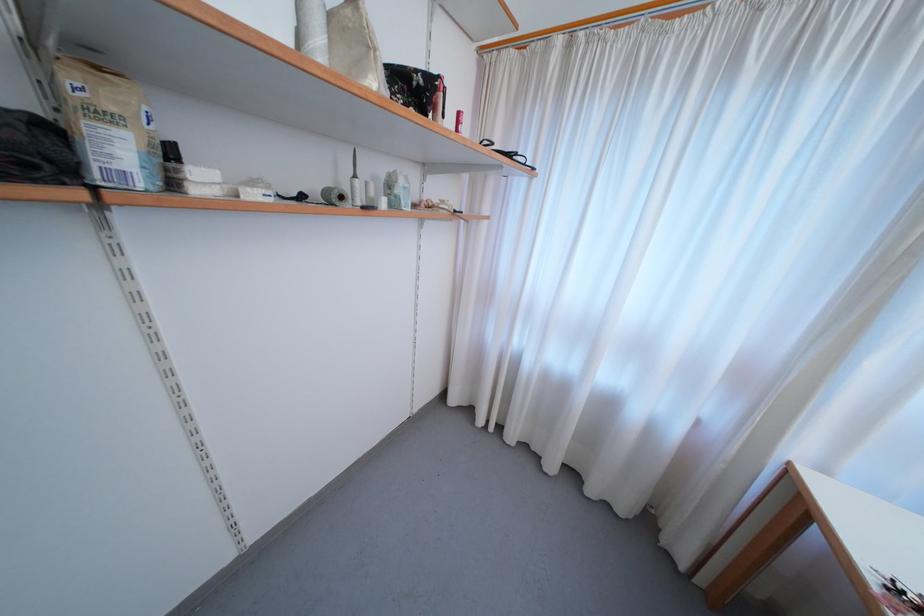
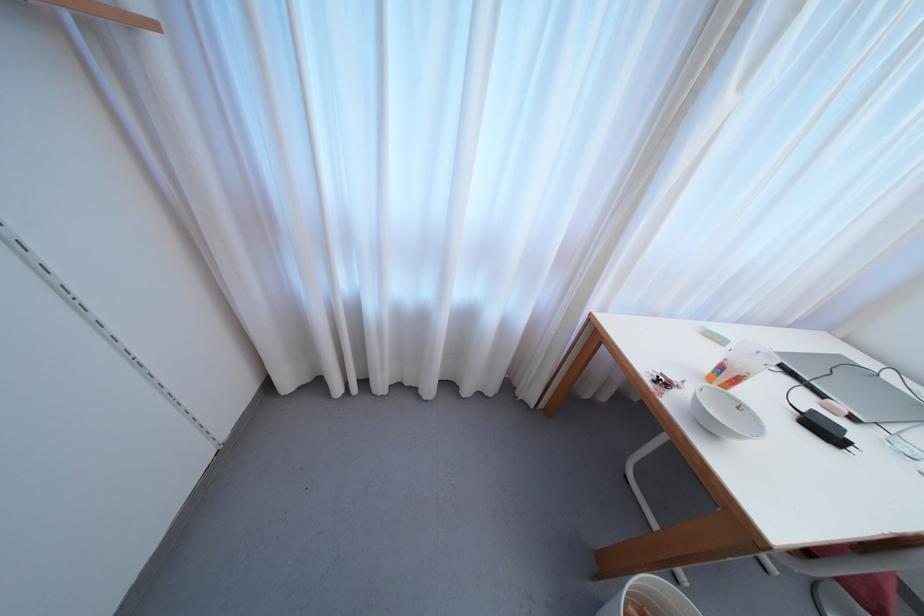
In the second image, find the point that corresponds to the point at 484,424 in the first image.

(342, 392)